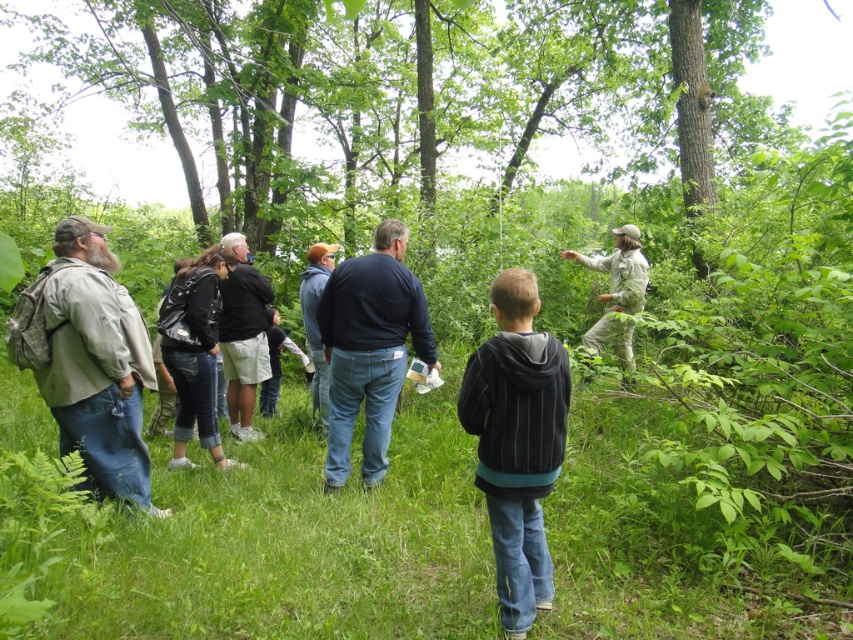
You are a photographer trying to capture a group photo of the black striped hoodie at center and the camouflage backpack at left. You need to ensure both subjects are in focus. Given that your camera can only focus on objects within a 1.2 meter width range, will you be able to capture both in focus?

The black striped hoodie at center is narrower than the camouflage backpack at left. Since the camera can focus on objects within a 1.2 meter width range, and the difference in their widths is less than 1.2 meters, both subjects can be captured in focus.

Based on the photo, you are a photographer trying to capture a candid shot of the dark blue sweater at center and the blue denim jeans at center. Since you want to ensure both are clearly visible, which object should you focus on first considering their sizes?

The dark blue sweater at center is larger in size than the blue denim jeans at center, so you should focus on the dark blue sweater at center first as it occupies more space in the frame and will require more attention to detail to capture clearly.

You are a photographer trying to capture a clear photo of the dark blue sweater at center and the blue denim jeans at center. Since you want both subjects to be in focus, which one should you focus on first?

You should focus on the dark blue sweater at center first because it is in front of the blue denim jeans at center, so focusing on the closer subject will ensure both are in focus.